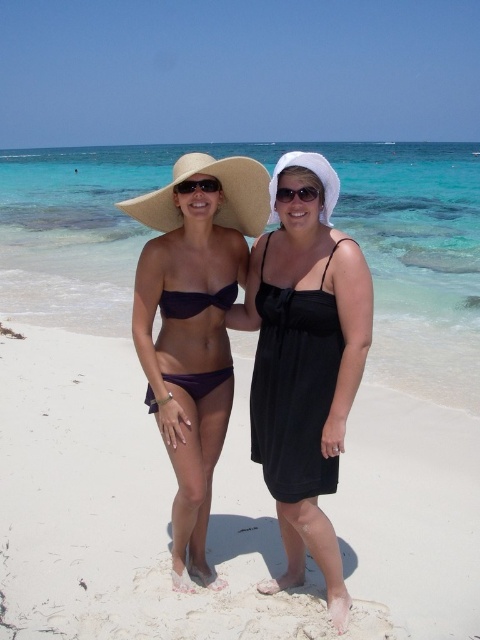
Question: Which of these objects is positioned closest to the black plastic sunglasses at center?

Choices:
 (A) matte purple bikini top at center
 (B) black satin dress at center

Answer: (A)

Question: Can you confirm if matte purple bikini top at center is positioned to the left of black plastic sunglasses at center?

Choices:
 (A) no
 (B) yes

Answer: (B)

Question: Can you confirm if white sandy beach at center is positioned below purple matte bikini at center?

Choices:
 (A) no
 (B) yes

Answer: (B)

Question: Can you confirm if black plastic sunglasses at center is smaller than sunglasses at center?

Choices:
 (A) no
 (B) yes

Answer: (A)

Question: Which point appears closest to the camera in this image?

Choices:
 (A) (214, 188)
 (B) (192, 464)
 (C) (85, 416)
 (D) (280, 189)

Answer: (D)

Question: Among these points, which one is nearest to the camera?

Choices:
 (A) (216, 372)
 (B) (176, 253)
 (C) (284, 385)

Answer: (C)